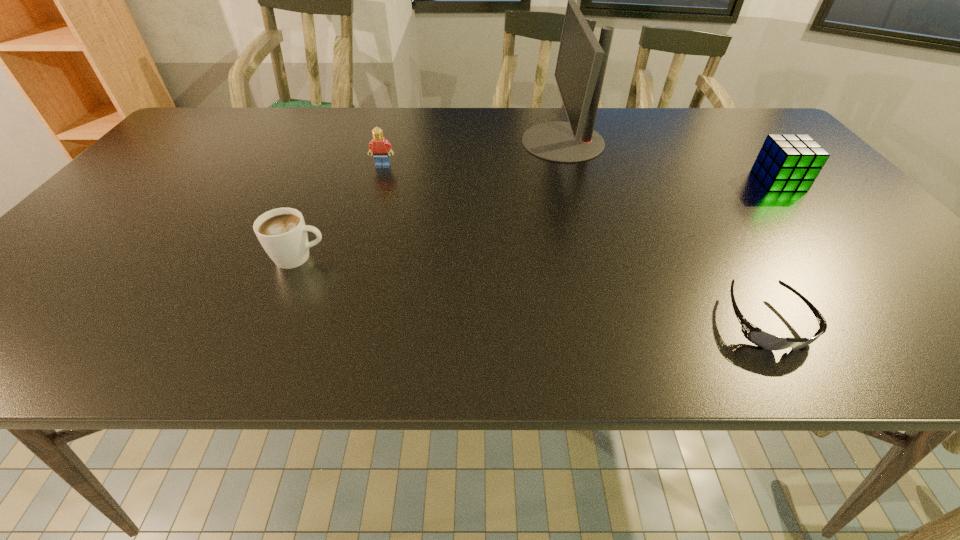
Locate an element on the screen. vacant area between the fourth object from right to left and the leftmost object is located at coordinates (341, 212).

Find the location of a particular element. Image resolution: width=960 pixels, height=540 pixels. vacant area that lies between the rightmost object and the Lego is located at coordinates (581, 173).

Choose which object is the fourth nearest neighbor to the rightmost object. Please provide its 2D coordinates. Your answer should be formatted as a tuple, i.e. [(x, y)], where the tuple contains the x and y coordinates of a point satisfying the conditions above.

[(282, 232)]

Identify which object is the fourth closest to the rightmost object. Please provide its 2D coordinates. Your answer should be formatted as a tuple, i.e. [(x, y)], where the tuple contains the x and y coordinates of a point satisfying the conditions above.

[(282, 232)]

The width and height of the screenshot is (960, 540). I want to click on vacant area that satisfies the following two spatial constraints: 1. on the front-facing side of the cube; 2. on the left side of the Lego, so click(x=378, y=180).

Find the location of a particular element. Image resolution: width=960 pixels, height=540 pixels. free location that satisfies the following two spatial constraints: 1. on the screen of the cube; 2. on the right side of the third object from left to right is located at coordinates (573, 180).

Locate an element on the screen. Image resolution: width=960 pixels, height=540 pixels. vacant region that satisfies the following two spatial constraints: 1. on the screen of the rightmost object; 2. on the left side of the computer monitor is located at coordinates (573, 180).